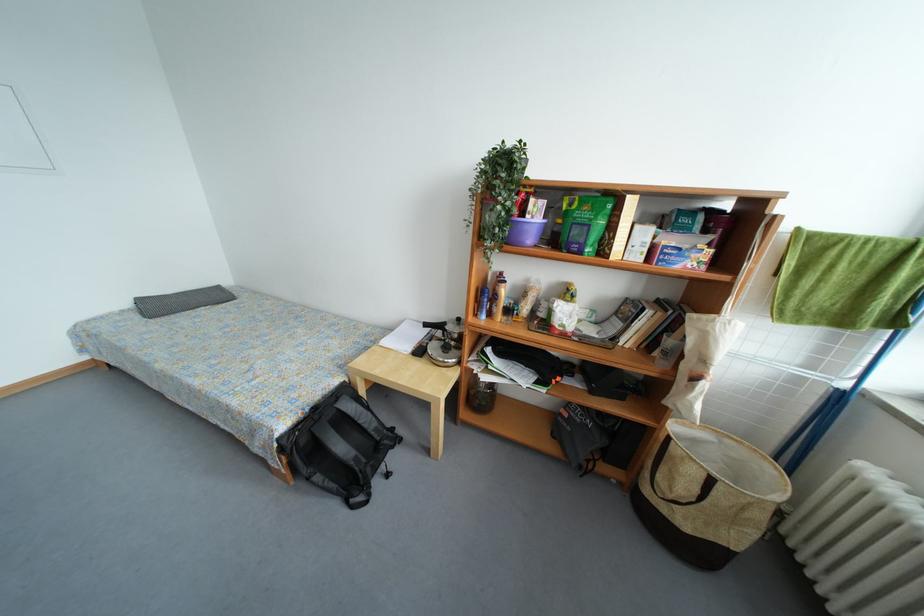
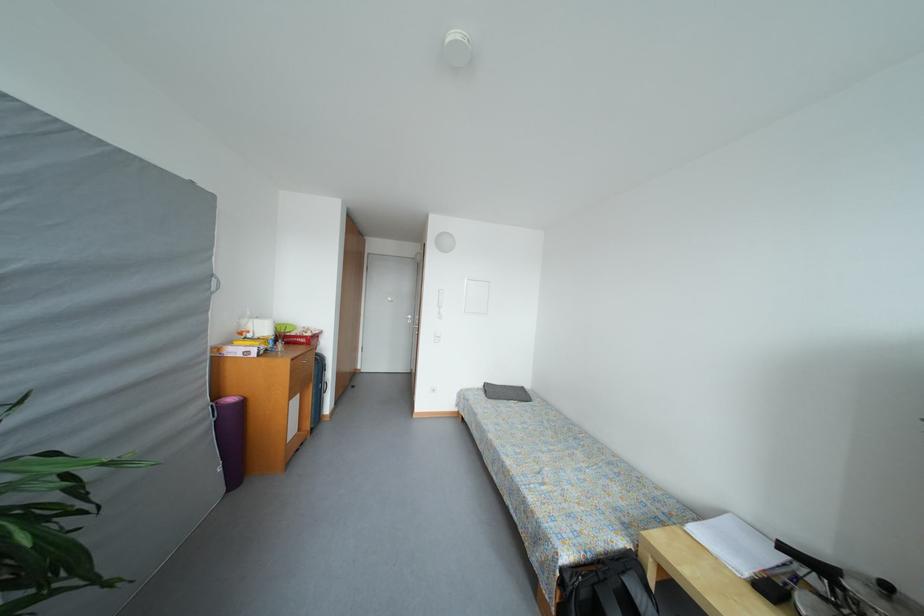
Find the pixel in the second image that matches point 382,352 in the first image.

(684, 533)